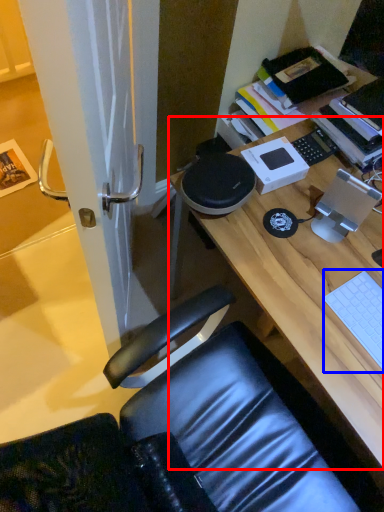
Question: Which object appears farthest to the camera in this image, desk (highlighted by a red box) or laptop keyboard (highlighted by a blue box)?

Choices:
 (A) desk
 (B) laptop keyboard

Answer: (B)